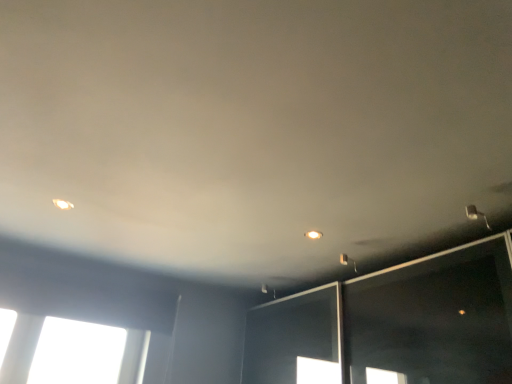
Question: Is matte white light fixture at upper right outside of matte white light fixture at upper right, which appears as the 1th dot when ordered from the bottom?

Choices:
 (A) no
 (B) yes

Answer: (B)

Question: Can you confirm if matte white light fixture at upper right is wider than matte white light fixture at upper right, which appears as the 1th dot when ordered from the bottom?

Choices:
 (A) no
 (B) yes

Answer: (B)

Question: Is matte white light fixture at upper right looking in the opposite direction of matte white light fixture at upper right, the 1th dot from the right?

Choices:
 (A) no
 (B) yes

Answer: (A)

Question: Does matte white light fixture at upper right have a larger size compared to matte white light fixture at upper right, marked as the second dot in a top-to-bottom arrangement?

Choices:
 (A) yes
 (B) no

Answer: (A)

Question: Would you say matte white light fixture at upper right is a long distance from matte white light fixture at upper right, the 1th dot positioned from the back?

Choices:
 (A) no
 (B) yes

Answer: (A)

Question: In terms of width, does matte white light fixture at upper left, marked as the second dot in a bottom-to-top arrangement, look wider or thinner when compared to matte white light fixture at upper right?

Choices:
 (A) wide
 (B) thin

Answer: (B)

Question: From the image's perspective, is matte white light fixture at upper left, the first dot viewed from the left, above or below matte white light fixture at upper right?

Choices:
 (A) below
 (B) above

Answer: (B)

Question: Does point (61, 203) appear closer or farther from the camera than point (352, 264)?

Choices:
 (A) closer
 (B) farther

Answer: (A)

Question: Choose the correct answer: Is matte white light fixture at upper left, the first dot viewed from the left, inside matte white light fixture at upper right or outside it?

Choices:
 (A) inside
 (B) outside

Answer: (B)

Question: In the image, is matte white light fixture at upper right, the 1th dot from the right, on the left side or the right side of matte white light fixture at upper left, the first dot viewed from the left?

Choices:
 (A) right
 (B) left

Answer: (A)

Question: From a real-world perspective, relative to matte white light fixture at upper left, placed as the second dot when sorted from back to front, is matte white light fixture at upper right, the 1th dot from the right, vertically above or below?

Choices:
 (A) below
 (B) above

Answer: (B)

Question: From the image's perspective, is matte white light fixture at upper right, which is counted as the second dot, starting from the front, positioned above or below matte white light fixture at upper left, marked as the second dot in a bottom-to-top arrangement?

Choices:
 (A) below
 (B) above

Answer: (A)

Question: Is matte white light fixture at upper right, marked as the second dot in a top-to-bottom arrangement, inside or outside of matte white light fixture at upper left, marked as the second dot in a bottom-to-top arrangement?

Choices:
 (A) inside
 (B) outside

Answer: (B)

Question: From a real-world perspective, is matte white light fixture at upper right, which is counted as the second dot, starting from the front, physically located above or below matte white light fixture at upper right?

Choices:
 (A) above
 (B) below

Answer: (A)

Question: Is matte white light fixture at upper right, marked as the second dot in a top-to-bottom arrangement, wider or thinner than matte white light fixture at upper right?

Choices:
 (A) thin
 (B) wide

Answer: (A)